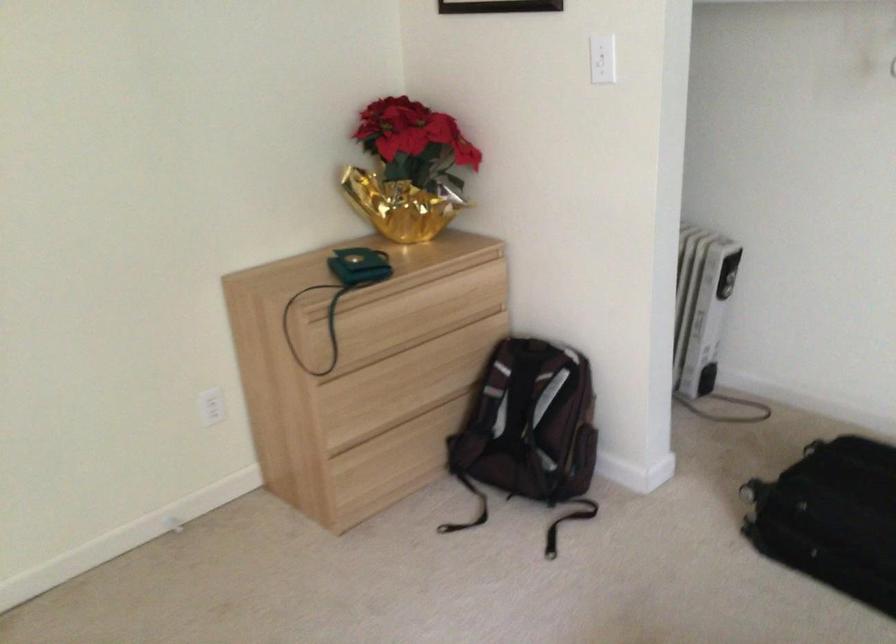
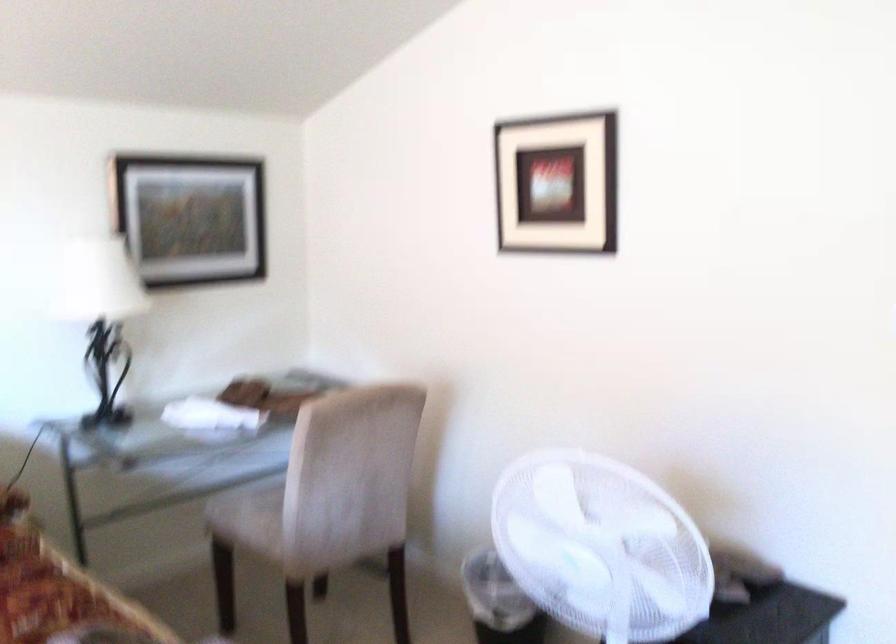
Question: The camera is either moving clockwise (left) or counter-clockwise (right) around the object. The first image is from the beginning of the video and the second image is from the end. Is the camera moving left or right when shooting the video?

Choices:
 (A) Left
 (B) Right

Answer: (B)